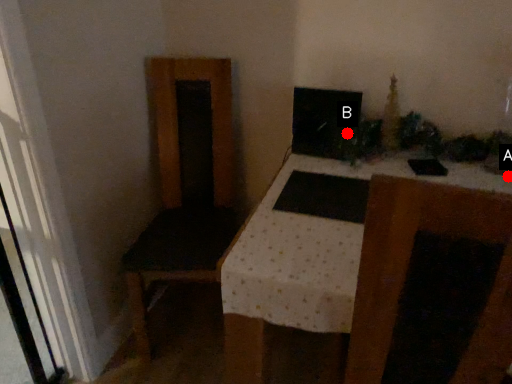
Question: Two points are circled on the image, labeled by A and B beside each circle. Among these points, which one is farthest from the camera?

Choices:
 (A) A is further
 (B) B is further

Answer: (B)